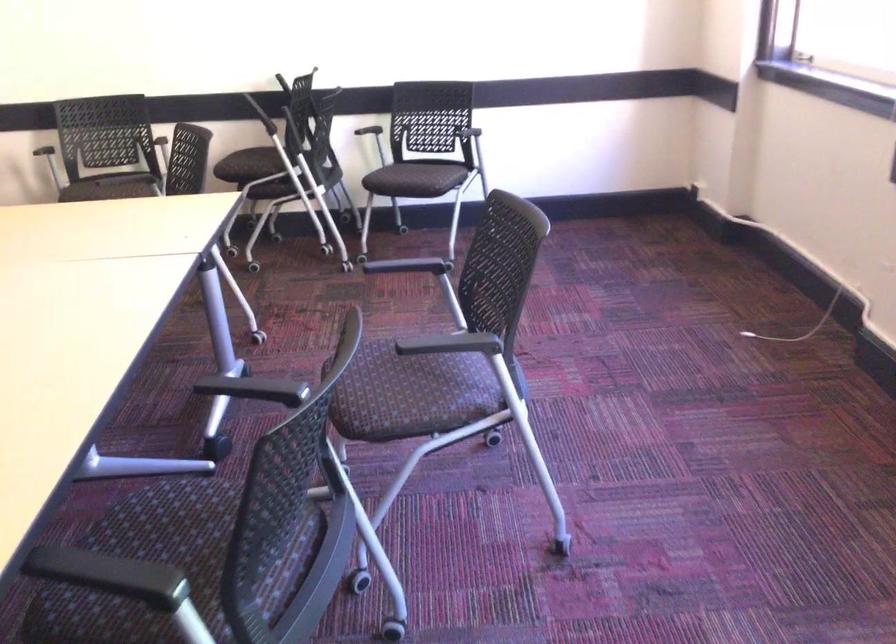
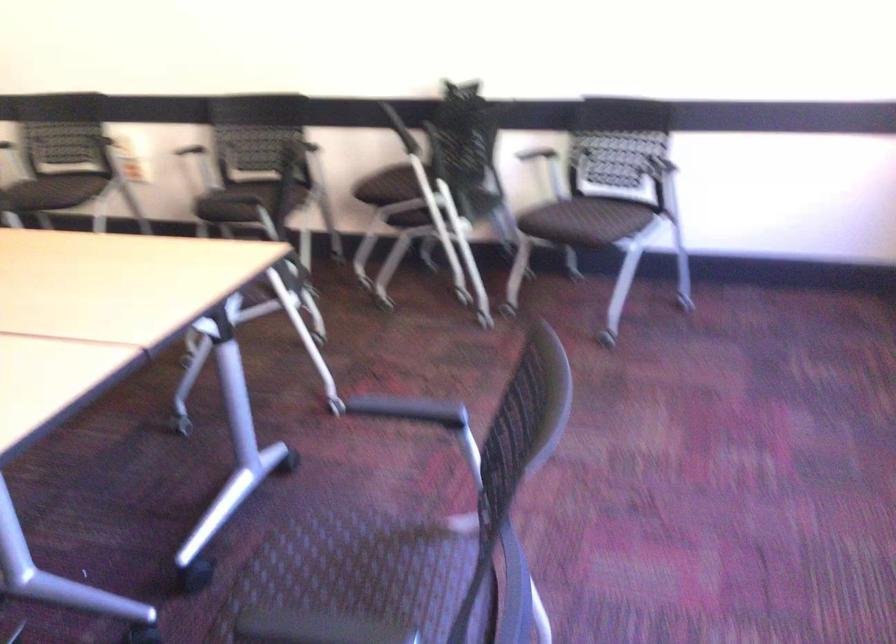
In a continuous first-person perspective shot, in which direction is the camera moving?

The cameraman moved toward right, forward.